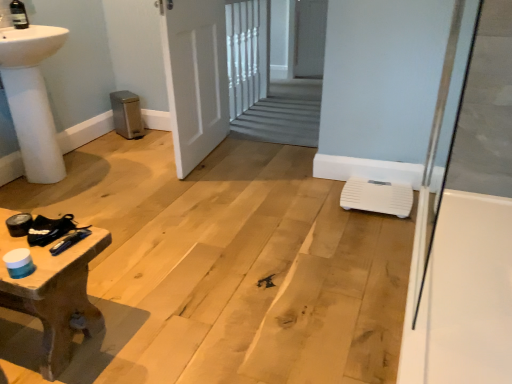
Where is `free spot to the left of metallic blue screwdriver at lower left`? free spot to the left of metallic blue screwdriver at lower left is located at coordinates (44, 239).